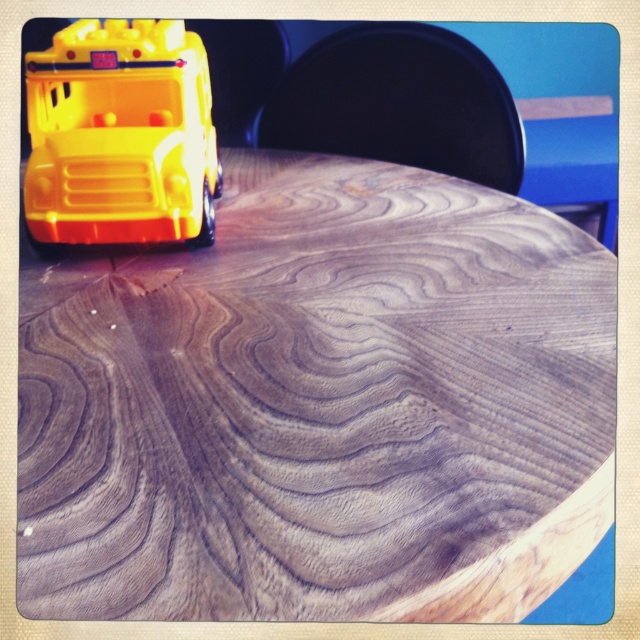
You are holding a ruler that is 24 inches long. You want to measure the distance from the camera to the wooden table at upper left. Can your ruler reach that distance?

The distance between the wooden table at upper left and the camera is 24.54 inches. Since your ruler is only 24 inches long, it cannot fully reach the distance of 24.54 inches.

You are organizing a childproofing inspection and need to ensure all small objects are placed away from table edges. You see the wooden table at upper left and the yellow plastic toy bus at upper left. Which object is closer to the right edge of the table?

The wooden table at upper left is to the right of the yellow plastic toy bus at upper left, meaning the wooden table at upper left is closer to the right edge of the table.

You are a delivery robot that needs to place a small package on the wooden table at upper left without moving the yellow plastic toy bus at upper left. Can you fit the package between them if the package is 25 centimeters wide?

The wooden table at upper left and yellow plastic toy bus at upper left are 24.69 centimeters apart from each other. Since the package is 25 centimeters wide, it is slightly wider than the available space, so the package cannot fit between them without moving the toy bus.